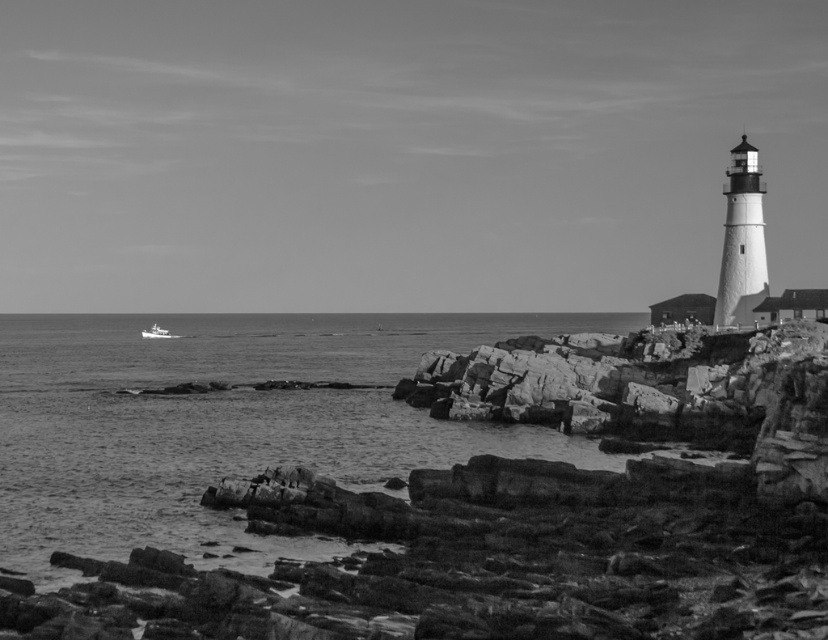
Question: Among these points, which one is farthest from the camera?

Choices:
 (A) (162, 337)
 (B) (451, 346)

Answer: (A)

Question: From the image, what is the correct spatial relationship of smooth water at lower left in relation to white plastic boat at left?

Choices:
 (A) below
 (B) above

Answer: (A)

Question: Which point is farther to the camera?

Choices:
 (A) (234, 417)
 (B) (161, 330)

Answer: (B)

Question: Does smooth water at lower left have a larger size compared to white plastic boat at left?

Choices:
 (A) no
 (B) yes

Answer: (B)

Question: Which of the following is the closest to the observer?

Choices:
 (A) white plastic boat at left
 (B) smooth water at lower left

Answer: (B)

Question: Does smooth water at lower left have a lesser width compared to white plastic boat at left?

Choices:
 (A) yes
 (B) no

Answer: (B)